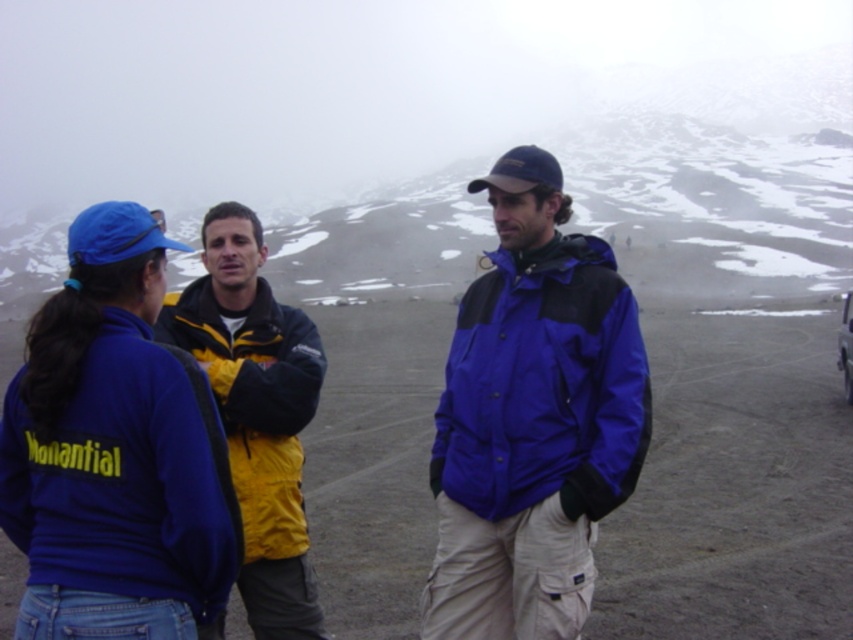
You are planning to take a photo of the blue matte jacket at center and the metallic silver car at right. Based on their sizes in the image, which object should you focus on first if you want to capture both in a single frame without zooming in or out?

The blue matte jacket at center occupies less space than the metallic silver car at right, so you should focus on the metallic silver car at right first to ensure it fits properly in the frame.